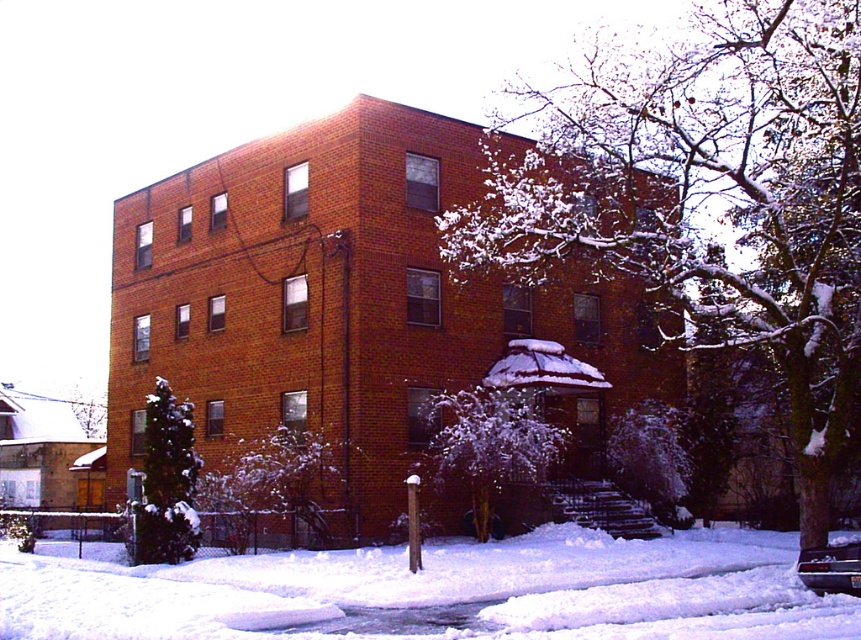
Looking at this image, can you confirm if white fluffy snow at lower center is shorter than green matte evergreen tree at lower left?

Correct, white fluffy snow at lower center is not as tall as green matte evergreen tree at lower left.

Measure the distance between point (42,554) and camera.

Point (42,554) and camera are 21.19 meters apart.

In order to click on white fluffy snow at lower center in this screenshot , I will do `click(431, 589)`.

Does green matte evergreen tree at lower left appear over green leafy tree at lower left?

Correct, green matte evergreen tree at lower left is located above green leafy tree at lower left.

Is green matte evergreen tree at lower left positioned at the back of green leafy tree at lower left?

No, green matte evergreen tree at lower left is in front of green leafy tree at lower left.

I want to click on green matte evergreen tree at lower left, so click(165, 484).

Image resolution: width=861 pixels, height=640 pixels. Describe the element at coordinates (707, 198) in the screenshot. I see `snow-covered branches at center` at that location.

Between snow-covered branches at center and white snow-covered tree at center, which one appears on the right side from the viewer's perspective?

From the viewer's perspective, snow-covered branches at center appears more on the right side.

At what (x,y) coordinates should I click in order to perform the action: click on snow-covered branches at center. Please return your answer as a coordinate pair (x, y). Image resolution: width=861 pixels, height=640 pixels. Looking at the image, I should click on (707, 198).

Find the location of `snow-covered branches at center`. snow-covered branches at center is located at coordinates (707, 198).